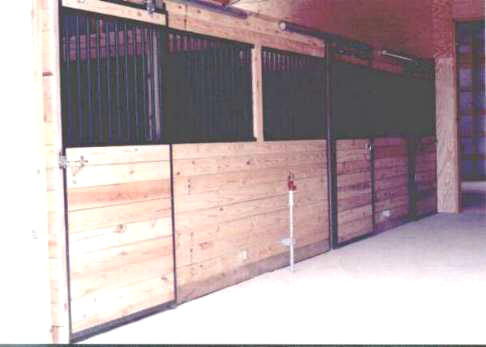
What are the coordinates of `bottom wood strips` in the screenshot? It's located at (158, 297), (216, 280), (352, 236), (387, 223), (427, 212).